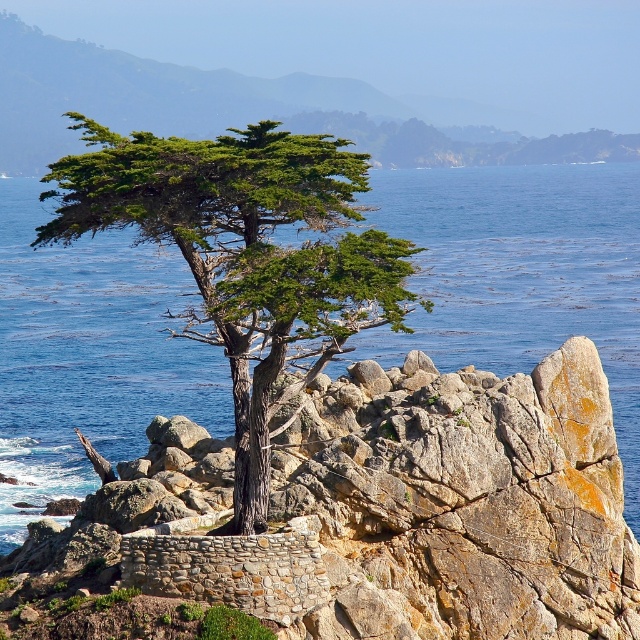
From the picture: You are a hiker who wants to take a photo of the rustic stone wall at center and the green textured cypress tree at center. Which one should you stand closer to in order to capture both in a single frame without zooming in?

The rustic stone wall at center is shorter than the green textured cypress tree at center. To capture both in a single frame without zooming, you should stand closer to the rustic stone wall at center so that the tree appears smaller in the frame while still including the wall.

You are a hiker who wants to take a photo of the green textured cypress tree at center. To do this, you need to walk around the rustic stone wall at center. Which direction should you move relative to the wall to get a clear view of the tree?

Since the rustic stone wall at center is closer to you than the green textured cypress tree at center, you should move to the side of the wall to get a clear view of the tree.